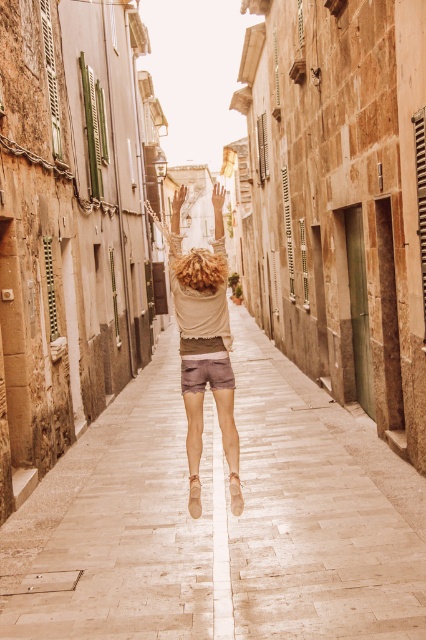
You are standing in the narrow alleyway between two old stone buildings. You want to place a small potted plant exactly at the center of the smooth stone pavement at center. According to the image, where should you place the potted plant?

The smooth stone pavement at center is located at point (221, 518), so you should place the potted plant at that coordinate.

You are standing in the alleyway and want to place a small potted plant between the smooth stone pavement at center and the beige cotton shorts at center. Which object should the plant be placed closer to based on their positions?

The smooth stone pavement at center is to the right of the beige cotton shorts at center, so the plant should be placed closer to the beige cotton shorts at center to maintain the spatial relationship.